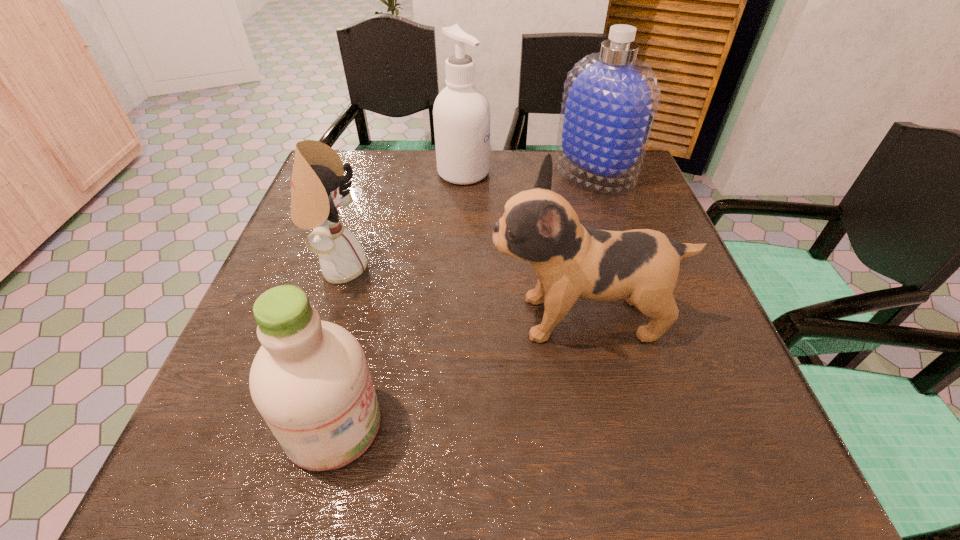
At what (x,y) coordinates should I click in order to perform the action: click on the rightmost cleansing agent. Please return your answer as a coordinate pair (x, y). This screenshot has height=540, width=960. Looking at the image, I should click on (610, 99).

Find the location of a particular element. This screenshot has width=960, height=540. the second cleansing agent from right to left is located at coordinates (461, 113).

The height and width of the screenshot is (540, 960). I want to click on puppy, so click(x=641, y=266).

Where is `doll`? This screenshot has width=960, height=540. doll is located at coordinates (317, 185).

This screenshot has width=960, height=540. Identify the location of the leftmost cleansing agent. (310, 381).

Locate an element on the screen. Image resolution: width=960 pixels, height=540 pixels. the nearest object is located at coordinates (310, 381).

The height and width of the screenshot is (540, 960). In order to click on vacant point located on the front of the rightmost cleansing agent in this screenshot , I will do `click(620, 253)`.

Locate an element on the screen. The image size is (960, 540). free space located 0.050m on the front label of the second cleansing agent from right to left is located at coordinates (508, 173).

Find the location of a particular element. vacant space located at the face of the puppy is located at coordinates (326, 318).

Image resolution: width=960 pixels, height=540 pixels. I want to click on vacant space located at the face of the puppy, so click(x=417, y=318).